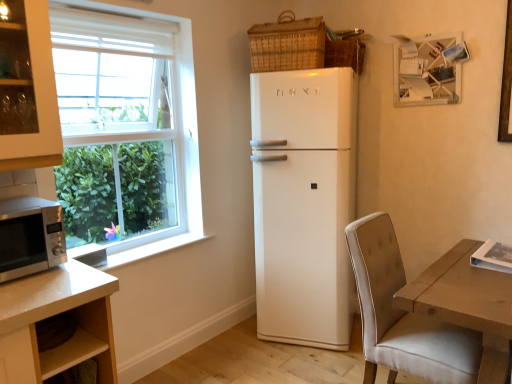
Locate an element on the screen. The height and width of the screenshot is (384, 512). satin silver microwave at lower left is located at coordinates (30, 237).

In the scene shown: How much space does woven brown basket at upper right, arranged as the 1th basket when viewed from the left, occupy vertically?

14.23 inches.

You are a GUI agent. You are given a task and a screenshot of the screen. Output one action in this format:
    pyautogui.click(x=<x>, y=<y>)
    Task: Click on the satin silver microwave at lower left
    This screenshot has width=512, height=384.
    Given the screenshot: What is the action you would take?
    click(x=30, y=237)

Which object is closer to the camera, woven wicker basket at upper right, the 2th basket from the left, or beige fabric chair at lower right?

beige fabric chair at lower right is in front.

Is woven wicker basket at upper right, the 2th basket from the left, taller than beige fabric chair at lower right?

Incorrect, the height of woven wicker basket at upper right, the 2th basket from the left, is not larger of that of beige fabric chair at lower right.

What's the angular difference between woven wicker basket at upper right, the 2th basket from the left, and beige fabric chair at lower right's facing directions?

woven wicker basket at upper right, the 2th basket from the left, and beige fabric chair at lower right are facing 84.2 degrees away from each other.

From the image's perspective, is woven wicker basket at upper right, the 1th basket positioned from the right, under beige fabric chair at lower right?

No.

Can you confirm if woven brown basket at upper right, arranged as the 1th basket when viewed from the left, is thinner than woven wicker basket at upper right, the 2th basket from the left?

Indeed, woven brown basket at upper right, arranged as the 1th basket when viewed from the left, has a lesser width compared to woven wicker basket at upper right, the 2th basket from the left.

Does point (319, 47) lie behind point (335, 56)?

No, it is not.

From the image's perspective, is woven brown basket at upper right, arranged as the 1th basket when viewed from the left, located beneath woven wicker basket at upper right, the 2th basket from the left?

No, from the image's perspective, woven brown basket at upper right, arranged as the 1th basket when viewed from the left, is not below woven wicker basket at upper right, the 2th basket from the left.

Is woven brown basket at upper right, arranged as the 1th basket when viewed from the left, directly adjacent to woven wicker basket at upper right, the 2th basket from the left?

No.

Is white matte picture frame at upper right spatially inside woven brown basket at upper right, acting as the second basket starting from the right, or outside of it?

white matte picture frame at upper right cannot be found inside woven brown basket at upper right, acting as the second basket starting from the right.

From the image's perspective, is white matte picture frame at upper right under woven brown basket at upper right, arranged as the 1th basket when viewed from the left?

Correct, white matte picture frame at upper right appears lower than woven brown basket at upper right, arranged as the 1th basket when viewed from the left, in the image.

Considering their positions, is beige fabric chair at lower right located in front of or behind woven brown basket at upper right, arranged as the 1th basket when viewed from the left?

Clearly, beige fabric chair at lower right is in front of woven brown basket at upper right, arranged as the 1th basket when viewed from the left.

Consider the image. From the image's perspective, is beige fabric chair at lower right located beneath woven brown basket at upper right, arranged as the 1th basket when viewed from the left?

Correct, beige fabric chair at lower right appears lower than woven brown basket at upper right, arranged as the 1th basket when viewed from the left, in the image.

Is beige fabric chair at lower right not near woven brown basket at upper right, arranged as the 1th basket when viewed from the left?

beige fabric chair at lower right is positioned a significant distance from woven brown basket at upper right, arranged as the 1th basket when viewed from the left.

Looking at this image, how many degrees apart are the facing directions of woven brown basket at upper right, acting as the second basket starting from the right, and beige fabric chair at lower right?

The angular difference between woven brown basket at upper right, acting as the second basket starting from the right, and beige fabric chair at lower right is 70.2 degrees.

Is woven brown basket at upper right, arranged as the 1th basket when viewed from the left, thinner than beige fabric chair at lower right?

Indeed, woven brown basket at upper right, arranged as the 1th basket when viewed from the left, has a lesser width compared to beige fabric chair at lower right.

Is woven brown basket at upper right, acting as the second basket starting from the right, far from beige fabric chair at lower right?

That's right, there is a large distance between woven brown basket at upper right, acting as the second basket starting from the right, and beige fabric chair at lower right.

Can you confirm if woven brown basket at upper right, acting as the second basket starting from the right, is positioned to the right of beige fabric chair at lower right?

No, woven brown basket at upper right, acting as the second basket starting from the right, is not to the right of beige fabric chair at lower right.

Do you think white matte picture frame at upper right is within white glossy refrigerator at center, or outside of it?

white matte picture frame at upper right is not inside white glossy refrigerator at center, it's outside.

From their relative heights in the image, would you say white matte picture frame at upper right is taller or shorter than white glossy refrigerator at center?

In the image, white matte picture frame at upper right appears to be shorter than white glossy refrigerator at center.

From the image's perspective, is white matte picture frame at upper right on white glossy refrigerator at center?

Yes, from the image's perspective, white matte picture frame at upper right is on top of white glossy refrigerator at center.

Based on the photo, from the image's perspective, is beige fabric chair at lower right on top of satin silver microwave at lower left?

No, from the image's perspective, beige fabric chair at lower right is not over satin silver microwave at lower left.

Is point (466, 332) closer to viewer compared to point (47, 259)?

No.

Which of these two, beige fabric chair at lower right or satin silver microwave at lower left, is wider?

With larger width is beige fabric chair at lower right.

Locate an element on the screen. The height and width of the screenshot is (384, 512). microwave oven on the left of beige fabric chair at lower right is located at coordinates (30, 237).

Locate an element on the screen. basket that is the 1st one when counting upward from the beige fabric chair at lower right (from the image's perspective) is located at coordinates (345, 54).

Image resolution: width=512 pixels, height=384 pixels. I want to click on basket in front of the woven wicker basket at upper right, the 1th basket positioned from the right, so click(x=287, y=44).

When comparing their distances from white matte picture frame at upper right, does woven brown basket at upper right, acting as the second basket starting from the right, or woven wicker basket at upper right, the 2th basket from the left, seem closer?

Based on the image, woven wicker basket at upper right, the 2th basket from the left, appears to be nearer to white matte picture frame at upper right.

Considering their positions, is white glossy refrigerator at center positioned closer to woven brown basket at upper right, arranged as the 1th basket when viewed from the left, than white matte picture frame at upper right?

white glossy refrigerator at center is closer to woven brown basket at upper right, arranged as the 1th basket when viewed from the left.

Estimate the real-world distances between objects in this image. Which object is closer to woven wicker basket at upper right, the 2th basket from the left, woven brown basket at upper right, arranged as the 1th basket when viewed from the left, or satin silver microwave at lower left?

woven brown basket at upper right, arranged as the 1th basket when viewed from the left, is closer to woven wicker basket at upper right, the 2th basket from the left.

Based on their spatial positions, is woven brown basket at upper right, acting as the second basket starting from the right, or satin silver microwave at lower left further from white glossy refrigerator at center?

satin silver microwave at lower left is positioned further to the anchor white glossy refrigerator at center.

Which object lies further to the anchor point woven wicker basket at upper right, the 1th basket positioned from the right, satin silver microwave at lower left or white glossy refrigerator at center?

satin silver microwave at lower left lies further to woven wicker basket at upper right, the 1th basket positioned from the right, than the other object.

Looking at the image, which one is located closer to white glossy refrigerator at center, beige fabric chair at lower right or woven wicker basket at upper right, the 1th basket positioned from the right?

The object closer to white glossy refrigerator at center is beige fabric chair at lower right.

Looking at the image, which one is located closer to white glossy refrigerator at center, beige fabric chair at lower right or white matte picture frame at upper right?

The object closer to white glossy refrigerator at center is beige fabric chair at lower right.

When comparing their distances from satin silver microwave at lower left, does beige fabric chair at lower right or woven brown basket at upper right, arranged as the 1th basket when viewed from the left, seem further?

Among the two, woven brown basket at upper right, arranged as the 1th basket when viewed from the left, is located further to satin silver microwave at lower left.

Where is `picture frame between woven wicker basket at upper right, the 1th basket positioned from the right, and white glossy refrigerator at center, in the vertical direction`? Image resolution: width=512 pixels, height=384 pixels. picture frame between woven wicker basket at upper right, the 1th basket positioned from the right, and white glossy refrigerator at center, in the vertical direction is located at coordinates (426, 70).

What are the coordinates of `basket that lies between woven brown basket at upper right, arranged as the 1th basket when viewed from the left, and beige fabric chair at lower right from top to bottom` in the screenshot? It's located at (345, 54).

Identify the location of refrigerator between woven wicker basket at upper right, the 1th basket positioned from the right, and beige fabric chair at lower right from top to bottom. (304, 204).

Find the location of `refrigerator between satin silver microwave at lower left and beige fabric chair at lower right`. refrigerator between satin silver microwave at lower left and beige fabric chair at lower right is located at coordinates (304, 204).